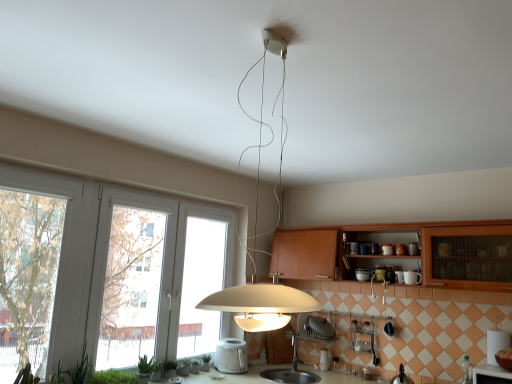
Question: Which direction should I rotate to look at white glossy toaster at center, which appears as the 1th appliance when viewed from the right, — up or down?

Choices:
 (A) down
 (B) up

Answer: (A)

Question: Does green leafy plant at lower left, the fourth plant viewed from the left, have a greater height compared to white glossy toaster at center, which appears as the 1th appliance when viewed from the right?

Choices:
 (A) yes
 (B) no

Answer: (B)

Question: Is green leafy plant at lower left, the 3th plant when ordered from right to left, smaller than white glossy toaster at center, the second appliance when ordered from left to right?

Choices:
 (A) no
 (B) yes

Answer: (A)

Question: Considering the relative sizes of green leafy plant at lower left, which ranks as the 3th plant in back-to-front order, and white glossy toaster at center, the second appliance when ordered from left to right, in the image provided, is green leafy plant at lower left, which ranks as the 3th plant in back-to-front order, wider than white glossy toaster at center, the second appliance when ordered from left to right,?

Choices:
 (A) yes
 (B) no

Answer: (A)

Question: From a real-world perspective, is green leafy plant at lower left, which ranks as the 3th plant in back-to-front order, under white glossy toaster at center, which appears as the 1th appliance when viewed from the right?

Choices:
 (A) yes
 (B) no

Answer: (A)

Question: Does green leafy plant at lower left, the fourth plant viewed from the left, have a larger size compared to white glossy toaster at center, which appears as the 1th appliance when viewed from the right?

Choices:
 (A) no
 (B) yes

Answer: (B)

Question: Is white glossy toaster at center, the second appliance when ordered from left to right, at the back of green leafy plant at lower left, the 3th plant when ordered from right to left?

Choices:
 (A) yes
 (B) no

Answer: (B)

Question: From the image's perspective, is white plastic toaster at center, the second appliance in the right-to-left sequence, under green matte plant at lower center, placed as the first plant when sorted from right to left?

Choices:
 (A) no
 (B) yes

Answer: (A)

Question: Does white plastic toaster at center, the first appliance viewed from the left, contain green matte plant at lower center, placed as the sixth plant when sorted from left to right?

Choices:
 (A) yes
 (B) no

Answer: (B)

Question: Is white plastic toaster at center, the second appliance in the right-to-left sequence, to the left of green matte plant at lower center, the 1th plant in the back-to-front sequence, from the viewer's perspective?

Choices:
 (A) no
 (B) yes

Answer: (A)

Question: From a real-world perspective, is white plastic toaster at center, the second appliance in the right-to-left sequence, under green matte plant at lower center, placed as the sixth plant when sorted from left to right?

Choices:
 (A) yes
 (B) no

Answer: (B)

Question: Considering the relative sizes of white plastic toaster at center, the first appliance viewed from the left, and green matte plant at lower center, the 1th plant in the back-to-front sequence, in the image provided, is white plastic toaster at center, the first appliance viewed from the left, shorter than green matte plant at lower center, the 1th plant in the back-to-front sequence,?

Choices:
 (A) yes
 (B) no

Answer: (B)

Question: Can we say white plastic toaster at center, the second appliance in the right-to-left sequence, lies outside green matte plant at lower center, placed as the sixth plant when sorted from left to right?

Choices:
 (A) yes
 (B) no

Answer: (A)

Question: Is wooden cabinet at center inside white glossy toaster at center, which appears as the 1th appliance when viewed from the right?

Choices:
 (A) yes
 (B) no

Answer: (B)